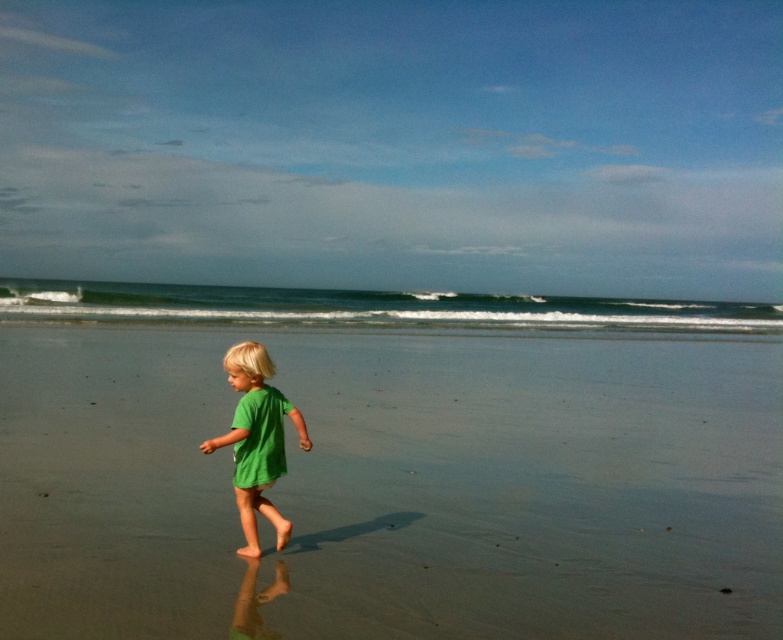
You are standing on the beach and see the smooth sand at center and the green matte shirt at center. Which object is located to the right of the other?

The smooth sand at center is to the right of the green matte shirt at center.